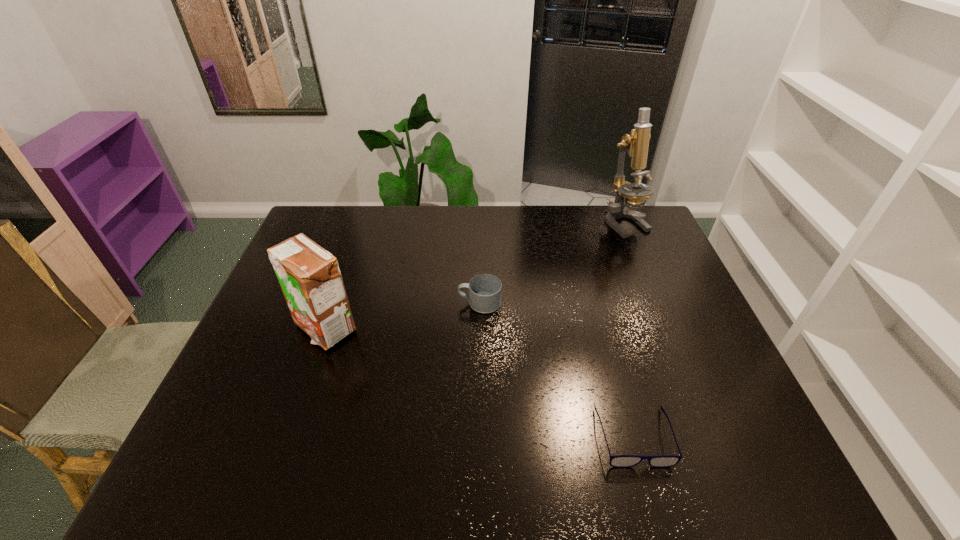
The image size is (960, 540). I want to click on vacant space located 0.130m on the side of the third tallest object with the handle, so click(414, 303).

The image size is (960, 540). I want to click on free space located 0.330m on the side of the third tallest object with the handle, so click(x=346, y=303).

Find the location of a particular element. This screenshot has width=960, height=540. vacant space positioned on the side of the third tallest object with the handle is located at coordinates (387, 303).

Locate an element on the screen. object situated at the far edge is located at coordinates 636,143.

Locate an element on the screen. object that is positioned at the near edge is located at coordinates (620, 461).

You are a GUI agent. You are given a task and a screenshot of the screen. Output one action in this format:
    pyautogui.click(x=<x>, y=<y>)
    Task: Click on the object that is at the left edge
    Image resolution: width=960 pixels, height=540 pixels.
    Given the screenshot: What is the action you would take?
    pos(309,276)

At what (x,y) coordinates should I click in order to perform the action: click on object present at the right edge. Please return your answer as a coordinate pair (x, y). Looking at the image, I should click on (636, 143).

The height and width of the screenshot is (540, 960). I want to click on object located at the far right corner, so click(636, 143).

Locate an element on the screen. The image size is (960, 540). vacant region at the far edge of the desktop is located at coordinates (392, 216).

In order to click on vacant space at the near edge in this screenshot , I will do `click(292, 462)`.